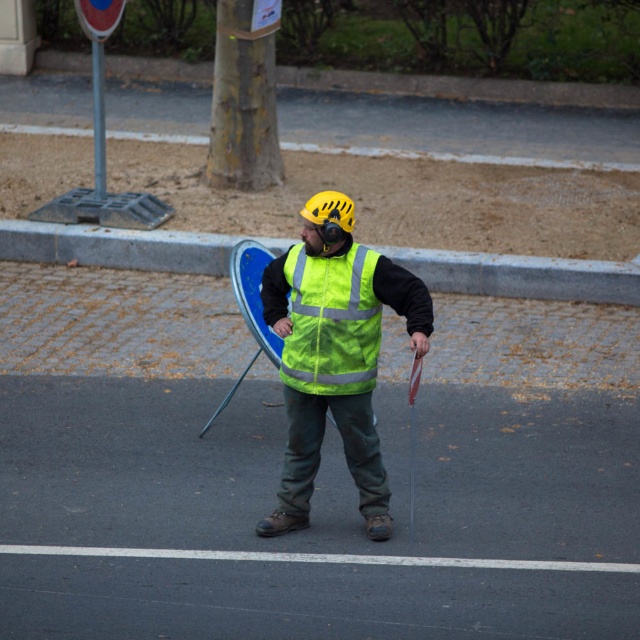
Based on the scene description, where is the high visibility fabric vest at center located in terms of coordinates?

The high visibility fabric vest at center is located at coordinates point (333, 355).